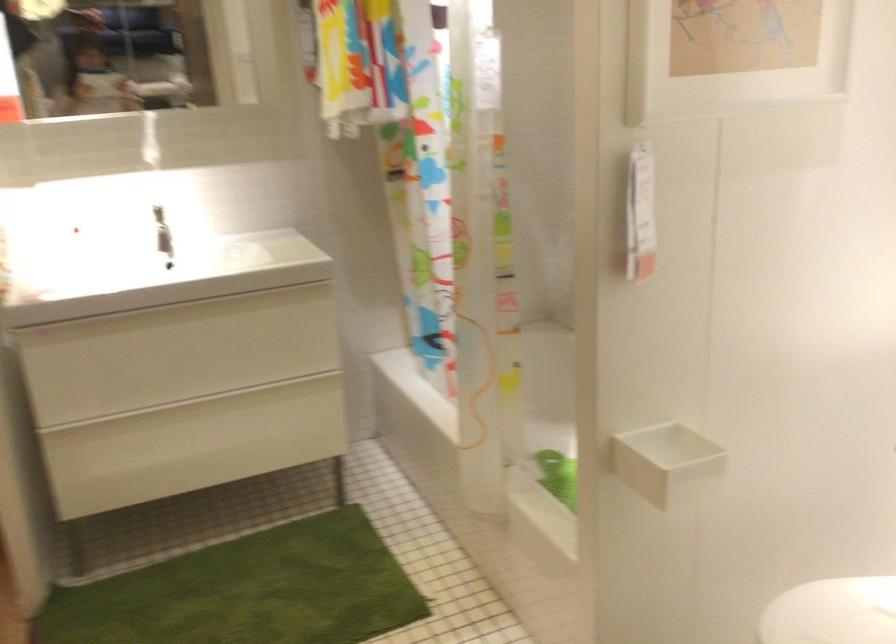
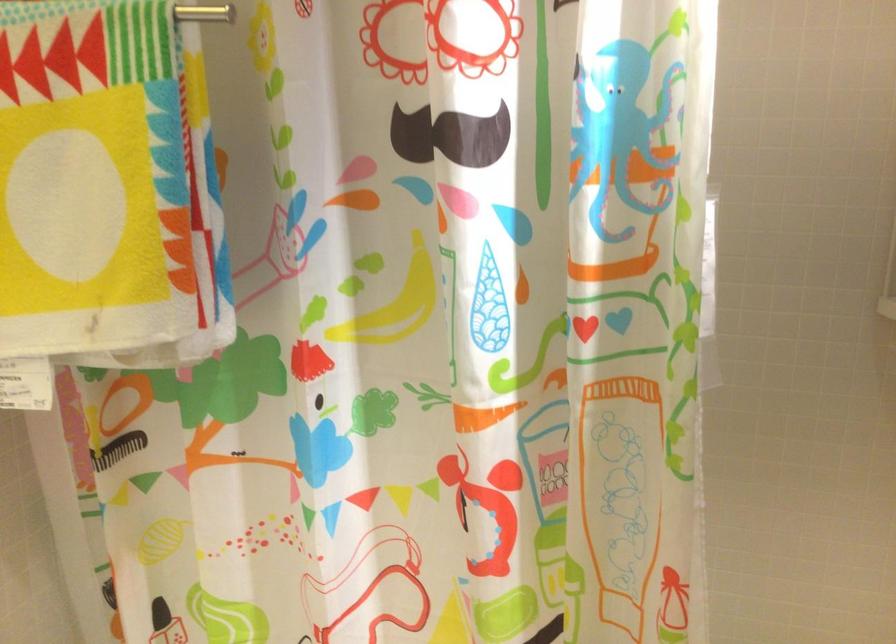
Where in the second image is the point corresponding to (346,134) from the first image?

(26, 384)